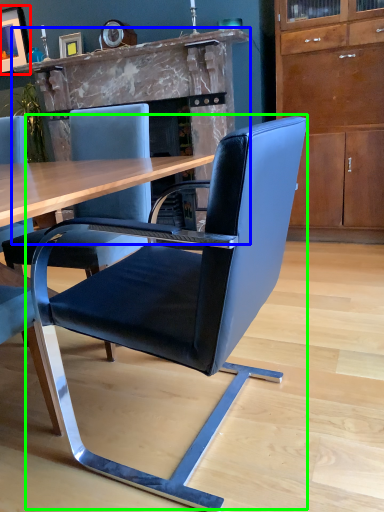
Question: Estimate the real-world distances between objects in this image. Which object is farther from picture frame (highlighted by a red box), fireplace (highlighted by a blue box) or chair (highlighted by a green box)?

Choices:
 (A) fireplace
 (B) chair

Answer: (B)